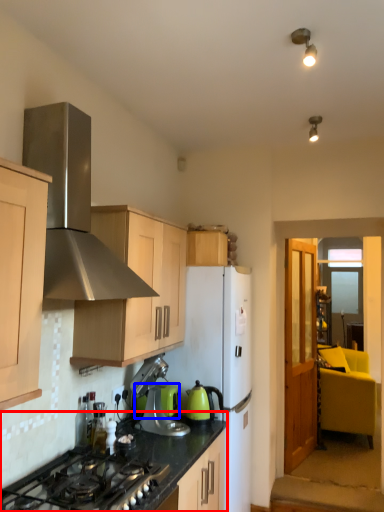
Question: Which of the following is the closest to the observer, countertop (highlighted by a red box) or appliance (highlighted by a blue box)?

Choices:
 (A) countertop
 (B) appliance

Answer: (A)